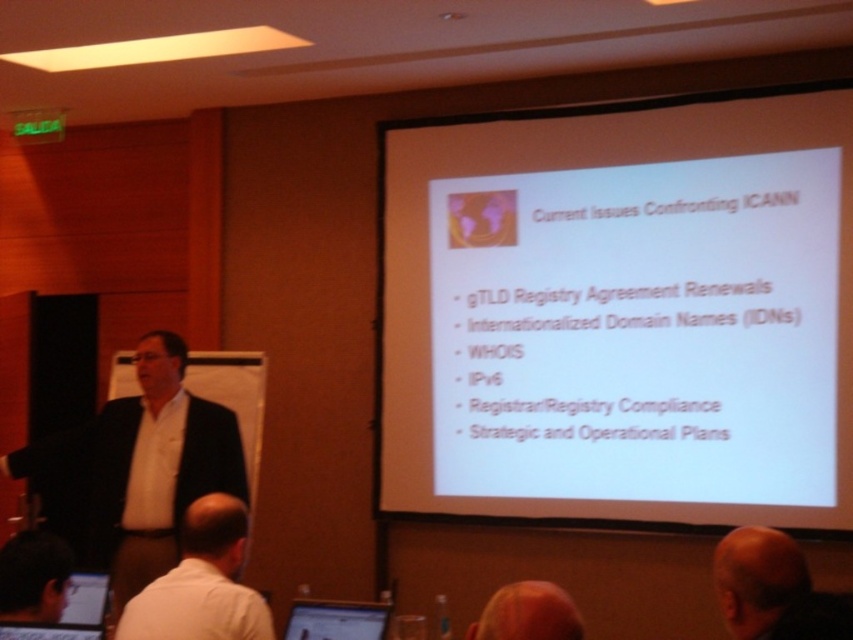
Question: Which object appears closest to the camera in this image?

Choices:
 (A) white shirt at left
 (B) matte black laptop at lower left
 (C) bald head at lower right

Answer: (C)

Question: Among these objects, which one is farthest from the camera?

Choices:
 (A) bald head at lower right
 (B) matte black laptop at lower left
 (C) white paper at upper center

Answer: (C)

Question: Can you confirm if white paper at upper center is wider than bald head at lower right?

Choices:
 (A) yes
 (B) no

Answer: (A)

Question: Which object appears farthest from the camera in this image?

Choices:
 (A) matte black laptop at lower center
 (B) brown hair at upper center
 (C) matte black laptop at lower left

Answer: (B)

Question: Does white shirt at left appear under matte black laptop at lower center?

Choices:
 (A) no
 (B) yes

Answer: (A)

Question: Can you confirm if white paper at upper center is thinner than matte black laptop at lower left?

Choices:
 (A) yes
 (B) no

Answer: (B)